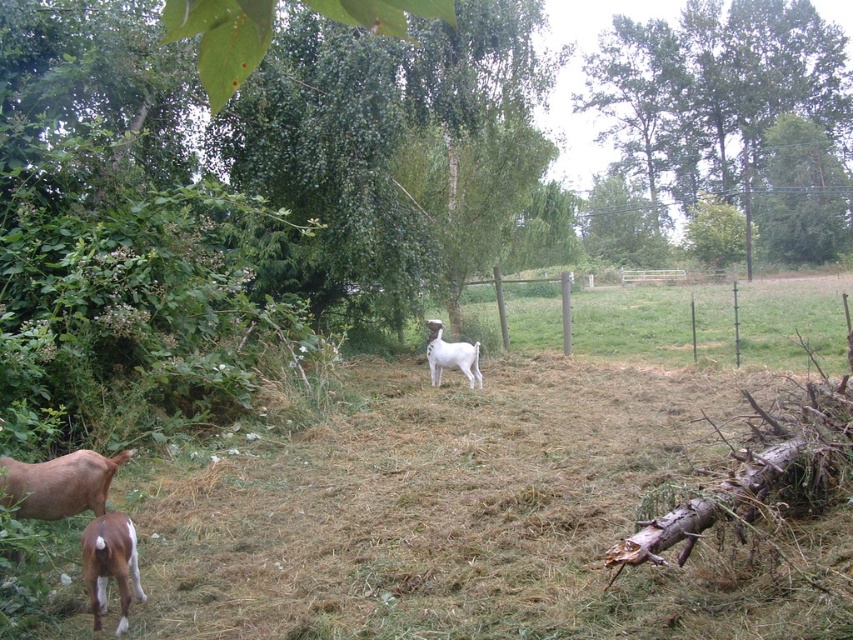
Can you confirm if green leafy tree at upper center is shorter than brown glossy goat at lower left?

In fact, green leafy tree at upper center may be taller than brown glossy goat at lower left.

Does green leafy tree at upper center have a smaller size compared to brown glossy goat at lower left?

Incorrect, green leafy tree at upper center is not smaller in size than brown glossy goat at lower left.

What do you see at coordinates (714, 92) in the screenshot? I see `green leafy tree at upper center` at bounding box center [714, 92].

The width and height of the screenshot is (853, 640). In order to click on green leafy tree at upper center in this screenshot , I will do `click(714, 92)`.

Between point (633, 136) and point (473, 381), which one is positioned behind?

The point (633, 136) is behind.

Can you confirm if green leafy tree at upper center is thinner than white woolen goat at center?

Incorrect, green leafy tree at upper center's width is not less than white woolen goat at center's.

Does point (596, 45) come behind point (432, 332)?

Yes.

The height and width of the screenshot is (640, 853). I want to click on green leafy tree at upper center, so click(x=714, y=92).

Looking at this image, is the position of brown glossy goat at lower left more distant than that of white woolen goat at center?

No, it is not.

Is brown glossy goat at lower left shorter than white woolen goat at center?

Indeed, brown glossy goat at lower left has a lesser height compared to white woolen goat at center.

Between point (119, 544) and point (440, 342), which one is positioned behind?

Point (440, 342)

Where is `brown glossy goat at lower left`? brown glossy goat at lower left is located at coordinates (109, 563).